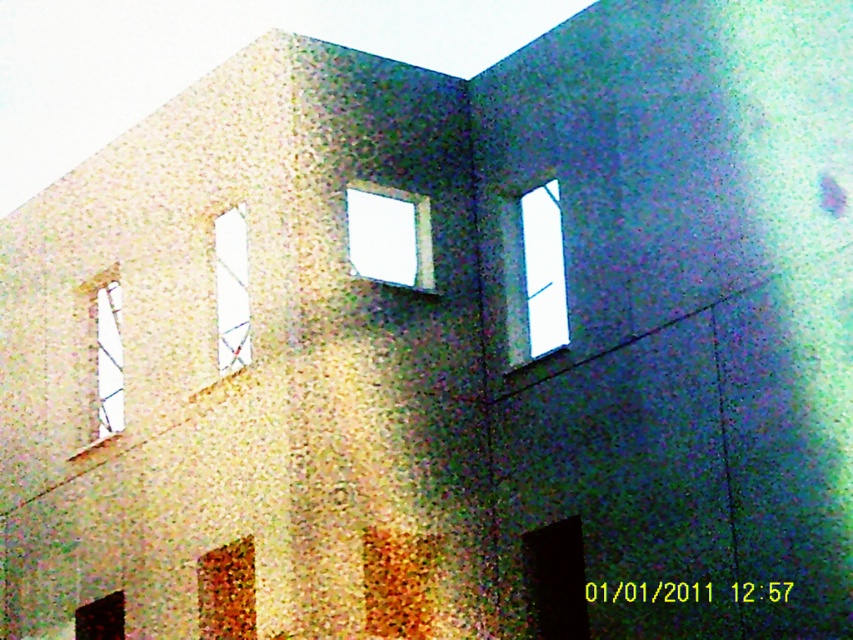
You are standing in front of the building and want to enter through one of the doorways. The transparent glass window at center and the matte glass window at lower left are both visible. Which window is positioned to the right side of the other?

The transparent glass window at center is positioned to the right of the matte glass window at lower left.

You are an architect designing a new building. You need to install solar panels on the largest window in the building. Which window should you choose between the transparent glass window at upper right and the transparent glass window at center?

The transparent glass window at upper right has a larger size compared to the transparent glass window at center, so you should install the solar panels on the transparent glass window at upper right.

Consider the image. You are an architect analyzing the building facade. You need to determine which of the two windows, the transparent glass window at upper right or the transparent glass window at center, has a larger height. Based on the description, which one is taller?

The transparent glass window at upper right has a greater height compared to the transparent glass window at center, so it is taller.